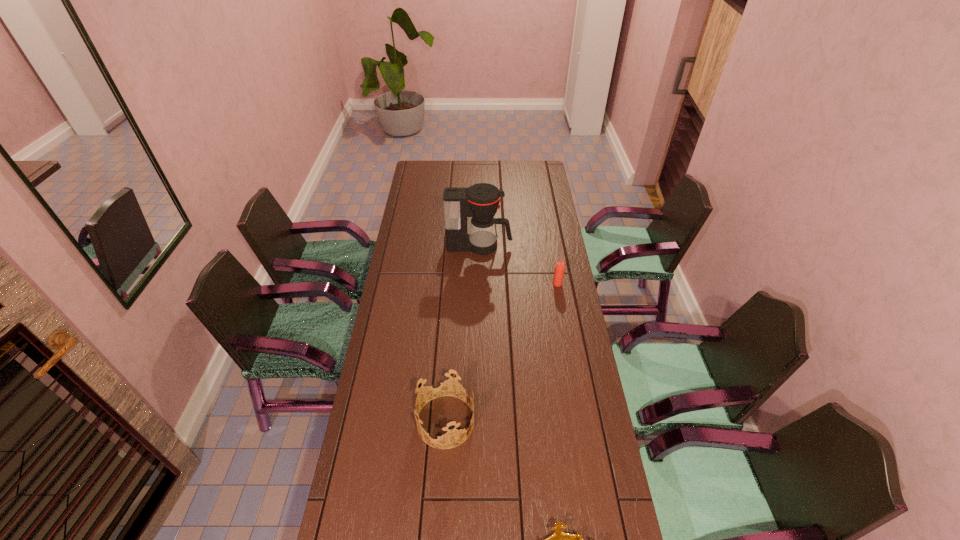
At what (x,y) coordinates should I click in order to perform the action: click on free space at the left edge of the desktop. Please return your answer as a coordinate pair (x, y). Looking at the image, I should click on (420, 195).

Locate an element on the screen. This screenshot has height=540, width=960. vacant space at the right edge is located at coordinates (566, 289).

You are a GUI agent. You are given a task and a screenshot of the screen. Output one action in this format:
    pyautogui.click(x=<x>, y=<y>)
    Task: Click on the vacant area at the far left corner
    The width and height of the screenshot is (960, 540).
    Given the screenshot: What is the action you would take?
    pyautogui.click(x=439, y=170)

In the image, there is a desktop. Where is `free region at the far right corner`? The height and width of the screenshot is (540, 960). free region at the far right corner is located at coordinates (548, 182).

Find the location of `free space between the taller crown and the tallest object`. free space between the taller crown and the tallest object is located at coordinates (463, 334).

I want to click on unoccupied position between the Tabasco sauce and the tallest object, so click(x=518, y=265).

Where is `vacant area that lies between the Tabasco sauce and the farther crown`? vacant area that lies between the Tabasco sauce and the farther crown is located at coordinates (501, 353).

You are a GUI agent. You are given a task and a screenshot of the screen. Output one action in this format:
    pyautogui.click(x=<x>, y=<y>)
    Task: Click on the object that is the third closest to the tallest object
    The width and height of the screenshot is (960, 540).
    Given the screenshot: What is the action you would take?
    pyautogui.click(x=560, y=539)

Find the location of `the closest object to the second farthest object`. the closest object to the second farthest object is located at coordinates (480, 201).